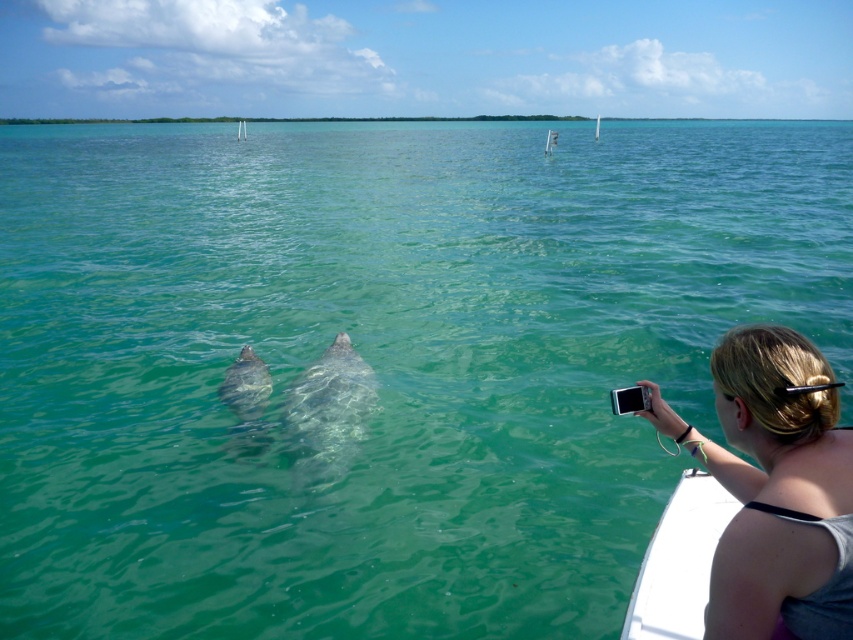
Is translucent gray dolphin at center to the right of white plastic pole at upper center from the viewer's perspective?

Correct, you'll find translucent gray dolphin at center to the right of white plastic pole at upper center.

Who is lower down, translucent gray dolphin at center or white plastic pole at upper center?

translucent gray dolphin at center is below.

Between point (339, 336) and point (239, 129), which one is positioned in front?

Point (339, 336) is more forward.

At what (x,y) coordinates should I click in order to perform the action: click on translucent gray dolphin at center. Please return your answer as a coordinate pair (x, y). The width and height of the screenshot is (853, 640). Looking at the image, I should click on (328, 412).

Is blonde hair at upper right above translucent gray dolphin at center?

Correct, blonde hair at upper right is located above translucent gray dolphin at center.

Between blonde hair at upper right and translucent gray dolphin at center, which one appears on the left side from the viewer's perspective?

From the viewer's perspective, translucent gray dolphin at center appears more on the left side.

Between point (782, 397) and point (299, 376), which one is positioned behind?

Positioned behind is point (299, 376).

The image size is (853, 640). What are the coordinates of `blonde hair at upper right` in the screenshot? It's located at [775, 488].

Can you confirm if gray matte whale at center is positioned to the right of white plastic pole at upper center?

Correct, you'll find gray matte whale at center to the right of white plastic pole at upper center.

Which of these two, gray matte whale at center or white plastic pole at upper center, stands shorter?

gray matte whale at center

Does point (257, 387) come closer to viewer compared to point (241, 122)?

Yes, point (257, 387) is in front of point (241, 122).

Find the location of a particular element. The image size is (853, 640). gray matte whale at center is located at coordinates (247, 400).